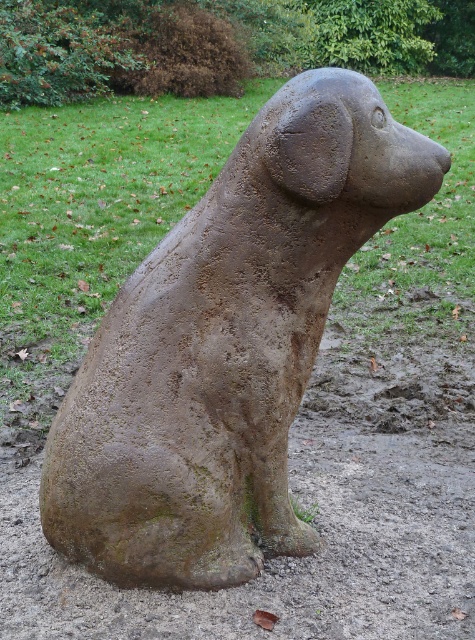
Who is positioned more to the left, rusty stone dog at center or brown textured dog at center?

brown textured dog at center is more to the left.

Where is `rusty stone dog at center`? Image resolution: width=475 pixels, height=640 pixels. rusty stone dog at center is located at coordinates (226, 346).

From the picture: Who is more forward, [304,296] or [311,449]?

Positioned in front is point [304,296].

At what (x,y) coordinates should I click in order to perform the action: click on rusty stone dog at center. Please return your answer as a coordinate pair (x, y). The height and width of the screenshot is (640, 475). Looking at the image, I should click on (226, 346).